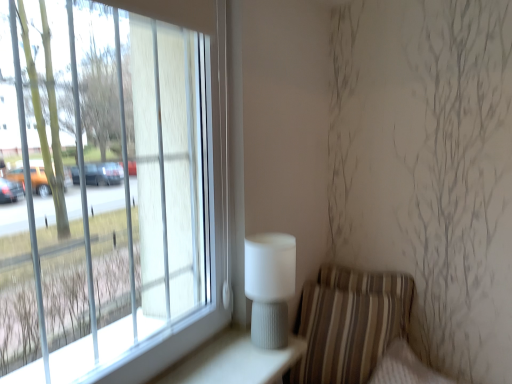
Image resolution: width=512 pixels, height=384 pixels. I want to click on striped fabric armchair at lower right, so click(x=349, y=323).

The height and width of the screenshot is (384, 512). Describe the element at coordinates (349, 323) in the screenshot. I see `striped fabric armchair at lower right` at that location.

What do you see at coordinates (270, 286) in the screenshot? I see `white ribbed table lamp at right` at bounding box center [270, 286].

The height and width of the screenshot is (384, 512). In order to click on white ribbed table lamp at right in this screenshot , I will do `click(270, 286)`.

This screenshot has height=384, width=512. Find the location of `striped fabric armchair at lower right`. striped fabric armchair at lower right is located at coordinates (349, 323).

Considering the relative positions of striped fabric armchair at lower right and white ribbed table lamp at right in the image provided, is striped fabric armchair at lower right to the right of white ribbed table lamp at right from the viewer's perspective?

Indeed, striped fabric armchair at lower right is positioned on the right side of white ribbed table lamp at right.

Is striped fabric armchair at lower right behind white ribbed table lamp at right?

Yes, it is.

Is point (353, 287) farther from camera compared to point (269, 262)?

Yes.

From the image's perspective, who appears lower, striped fabric armchair at lower right or white ribbed table lamp at right?

striped fabric armchair at lower right.

From a real-world perspective, is striped fabric armchair at lower right located higher than white ribbed table lamp at right?

Incorrect, from a real-world perspective, striped fabric armchair at lower right is lower than white ribbed table lamp at right.

Looking at this image, considering the relative sizes of striped fabric armchair at lower right and white ribbed table lamp at right in the image provided, is striped fabric armchair at lower right wider than white ribbed table lamp at right?

Indeed, striped fabric armchair at lower right has a greater width compared to white ribbed table lamp at right.

Between striped fabric armchair at lower right and white ribbed table lamp at right, which one has more height?

striped fabric armchair at lower right is taller.

Based on their sizes in the image, would you say striped fabric armchair at lower right is bigger or smaller than white ribbed table lamp at right?

Clearly, striped fabric armchair at lower right is larger in size than white ribbed table lamp at right.

Can we say striped fabric armchair at lower right lies outside white ribbed table lamp at right?

That's correct, striped fabric armchair at lower right is outside of white ribbed table lamp at right.

In the scene shown: Is striped fabric armchair at lower right positioned far away from white ribbed table lamp at right?

Answer: No, striped fabric armchair at lower right is not far from white ribbed table lamp at right.

Is striped fabric armchair at lower right looking in the opposite direction of white ribbed table lamp at right?

striped fabric armchair at lower right does not have its back to white ribbed table lamp at right.

Looking at this image, can you tell me how much striped fabric armchair at lower right and white ribbed table lamp at right differ in facing direction?

striped fabric armchair at lower right and white ribbed table lamp at right are facing 82.6 degrees away from each other.

How distant is striped fabric armchair at lower right from white ribbed table lamp at right?

18.66 inches.

What are the coordinates of `armchair that is under the white ribbed table lamp at right (from a real-world perspective)` in the screenshot? It's located at (349, 323).

Can you confirm if white ribbed table lamp at right is positioned to the left of striped fabric armchair at lower right?

Yes, white ribbed table lamp at right is to the left of striped fabric armchair at lower right.

Considering their positions, is white ribbed table lamp at right located in front of or behind striped fabric armchair at lower right?

white ribbed table lamp at right is positioned closer to the viewer than striped fabric armchair at lower right.

Between point (273, 341) and point (364, 359), which one is positioned in front?

The point (273, 341) is in front.

From the image's perspective, is white ribbed table lamp at right located above or below striped fabric armchair at lower right?

white ribbed table lamp at right is situated higher than striped fabric armchair at lower right in the image.

From a real-world perspective, between white ribbed table lamp at right and striped fabric armchair at lower right, who is vertically higher?

white ribbed table lamp at right.

Can you confirm if white ribbed table lamp at right is thinner than striped fabric armchair at lower right?

Correct, the width of white ribbed table lamp at right is less than that of striped fabric armchair at lower right.

Does white ribbed table lamp at right have a greater height compared to striped fabric armchair at lower right?

No.

Is white ribbed table lamp at right bigger than striped fabric armchair at lower right?

No, white ribbed table lamp at right is not bigger than striped fabric armchair at lower right.

Is white ribbed table lamp at right located outside striped fabric armchair at lower right?

Absolutely, white ribbed table lamp at right is external to striped fabric armchair at lower right.

Does white ribbed table lamp at right touch striped fabric armchair at lower right?

No, white ribbed table lamp at right is not touching striped fabric armchair at lower right.

Is white ribbed table lamp at right oriented towards striped fabric armchair at lower right?

No, white ribbed table lamp at right does not turn towards striped fabric armchair at lower right.

Can you tell me how much white ribbed table lamp at right and striped fabric armchair at lower right differ in facing direction?

There is a 82.6-degree angle between the facing directions of white ribbed table lamp at right and striped fabric armchair at lower right.

Image resolution: width=512 pixels, height=384 pixels. Find the location of `table lamp on the left of the striped fabric armchair at lower right`. table lamp on the left of the striped fabric armchair at lower right is located at coordinates (270, 286).

Where is `armchair on the right of white ribbed table lamp at right`? The image size is (512, 384). armchair on the right of white ribbed table lamp at right is located at coordinates (349, 323).

This screenshot has width=512, height=384. In order to click on table lamp above the striped fabric armchair at lower right (from a real-world perspective) in this screenshot , I will do `click(270, 286)`.